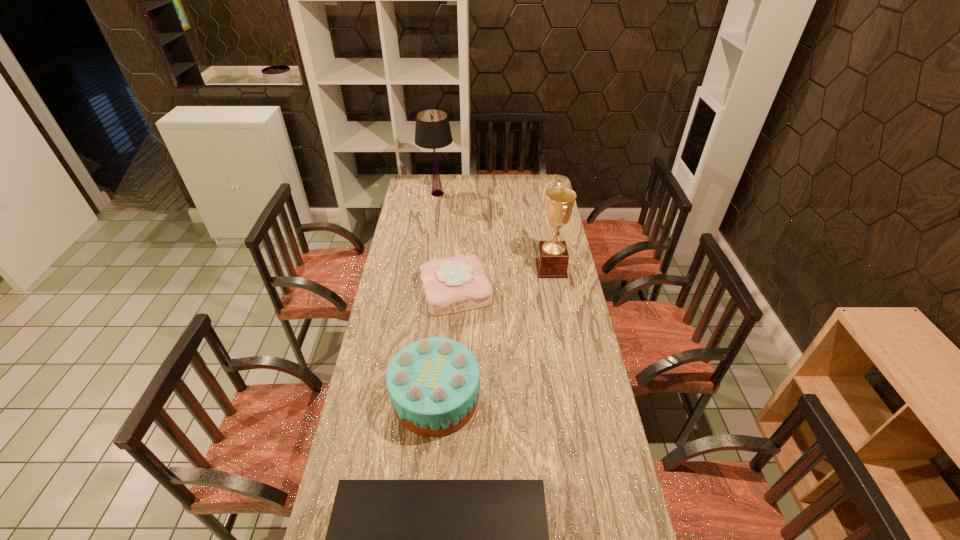
Locate an element on the screen. Image resolution: width=960 pixels, height=540 pixels. vacant space situated on the left of the shorter cake is located at coordinates (406, 291).

The width and height of the screenshot is (960, 540). What are the coordinates of `object that is at the far edge` in the screenshot? It's located at (432, 131).

Locate an element on the screen. The image size is (960, 540). lampshade that is at the left edge is located at coordinates (432, 131).

I want to click on cake situated at the left edge, so click(x=433, y=383).

Find the location of a particular element. The height and width of the screenshot is (540, 960). object present at the right edge is located at coordinates (552, 260).

Locate an element on the screen. The height and width of the screenshot is (540, 960). object at the far left corner is located at coordinates (432, 131).

Find the location of a particular element. This screenshot has height=540, width=960. vacant space at the far edge is located at coordinates (524, 181).

In the image, there is a desktop. Where is `vacant space at the left edge`? The image size is (960, 540). vacant space at the left edge is located at coordinates (421, 232).

In the image, there is a desktop. Where is `vacant space at the right edge`? vacant space at the right edge is located at coordinates point(581,509).

Locate an element on the screen. empty space between the trophy cup and the shorter cake is located at coordinates (503, 280).